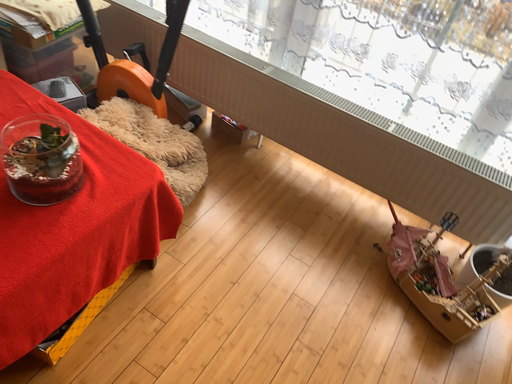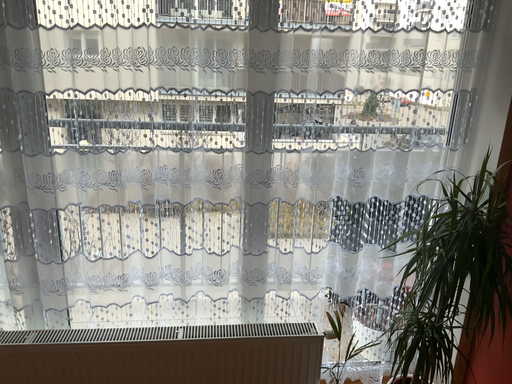
Question: How did the camera likely rotate when shooting the video?

Choices:
 (A) rotated upward
 (B) rotated downward

Answer: (A)